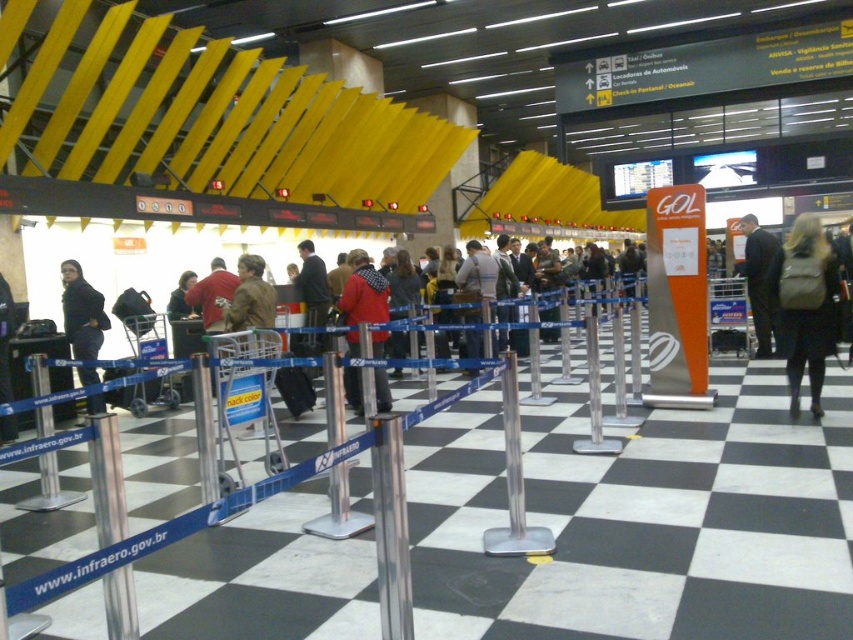
You are a traveler who just arrived at the airport. You see a leather backpack at right and a red woolen sweater at center. Which item is smaller in size?

The leather backpack at right is smaller than the red woolen sweater at center.

You are a passenger holding a small bag and need to reach the check counter. There is a leather backpack at right in your way. Can you walk around it? Please explain based on its position.

The leather backpack at right is located at point (805, 305). Since it has specific coordinates, it is stationary, so you can walk around it to reach the check counter.